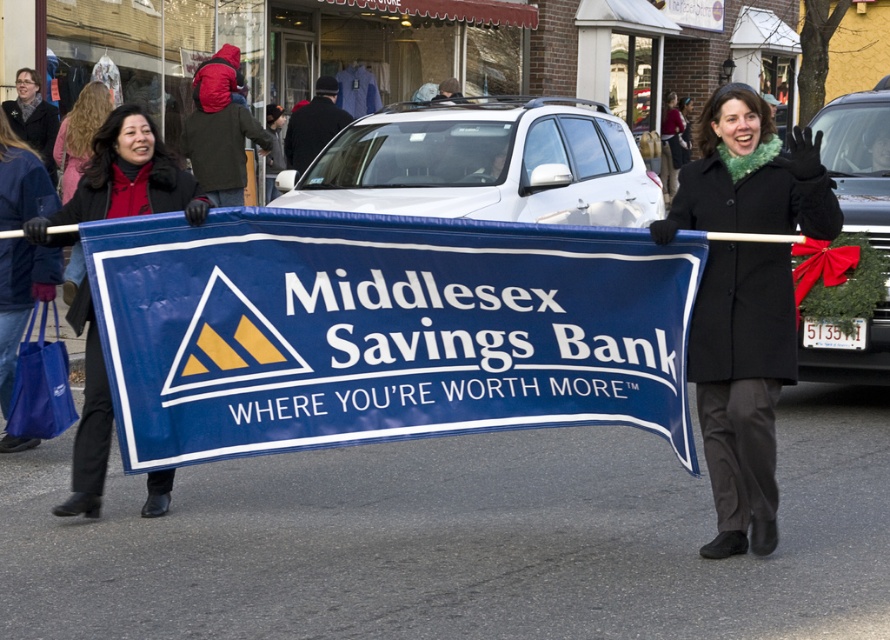
Who is higher up, black wool coat at center or matte black coat at center?

matte black coat at center

Does black wool coat at center have a lesser width compared to matte black coat at center?

Yes, black wool coat at center is thinner than matte black coat at center.

The image size is (890, 640). Describe the element at coordinates (742, 385) in the screenshot. I see `black wool coat at center` at that location.

This screenshot has height=640, width=890. What are the coordinates of `black wool coat at center` in the screenshot? It's located at (742, 385).

Is blue fabric banner at center above matte black coat at center?

No, blue fabric banner at center is not above matte black coat at center.

Between blue fabric banner at center and matte black coat at center, which one appears on the left side from the viewer's perspective?

matte black coat at center is more to the left.

Measure the distance between blue fabric banner at center and camera.

blue fabric banner at center and camera are 19.50 feet apart from each other.

You are a GUI agent. You are given a task and a screenshot of the screen. Output one action in this format:
    pyautogui.click(x=<x>, y=<y>)
    Task: Click on the blue fabric banner at center
    
    Given the screenshot: What is the action you would take?
    pyautogui.click(x=383, y=330)

Between blue fabric banner at center and black wool coat at center, which one is positioned lower?

Positioned lower is blue fabric banner at center.

Is point (449, 408) behind point (741, 412)?

That is True.

Locate an element on the screen. blue fabric banner at center is located at coordinates (383, 330).